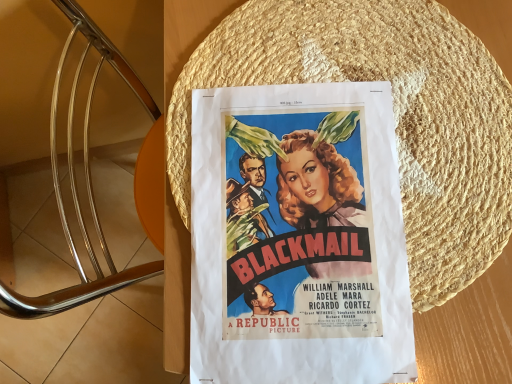
This screenshot has width=512, height=384. What are the coordinates of `free space above matte paper poster at center (from a real-world perspective)` in the screenshot? It's located at (303, 225).